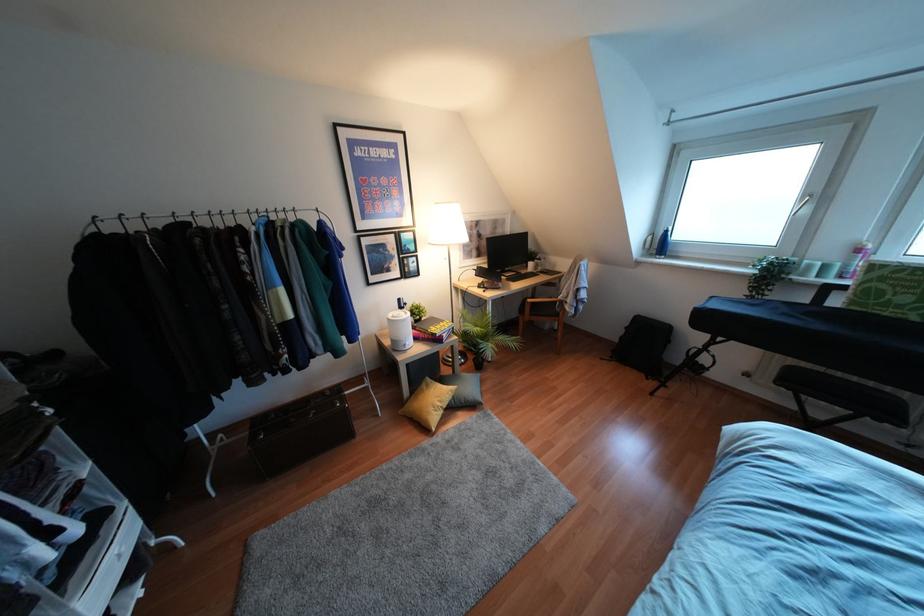
Find the location of `pink bottle`. pink bottle is located at coordinates (855, 260).